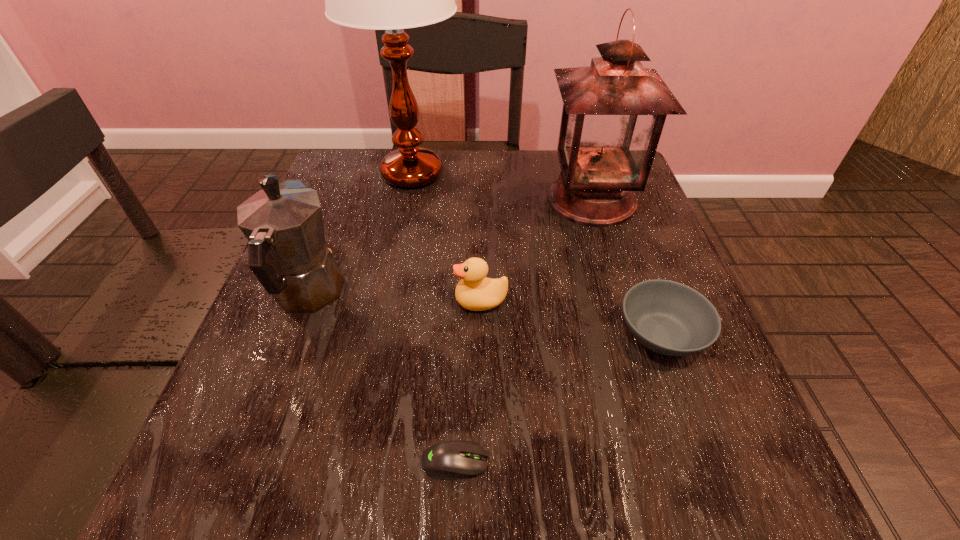
Find the location of a particular element. This screenshot has height=540, width=960. vacant space that's between the third tallest object and the duck is located at coordinates (395, 298).

Locate which object ranks fifth in proximity to the oil lamp. Please provide its 2D coordinates. Your answer should be formatted as a tuple, i.e. [(x, y)], where the tuple contains the x and y coordinates of a point satisfying the conditions above.

[(451, 460)]

Identify the location of object that can be found as the second closest to the tallest object. (614, 111).

Find the location of a particular element. This screenshot has width=960, height=540. vacant space that satisfies the following two spatial constraints: 1. on the front side of the soup bowl; 2. on the right side of the fifth shortest object is located at coordinates (633, 334).

Where is `blank area in the image that satisfies the following two spatial constraints: 1. on the front side of the second tallest object; 2. on the wheel side of the nearest object`? The image size is (960, 540). blank area in the image that satisfies the following two spatial constraints: 1. on the front side of the second tallest object; 2. on the wheel side of the nearest object is located at coordinates (672, 462).

Locate an element on the screen. The image size is (960, 540). free spot that satisfies the following two spatial constraints: 1. on the front side of the oil lamp; 2. on the wheel side of the shortest object is located at coordinates (672, 462).